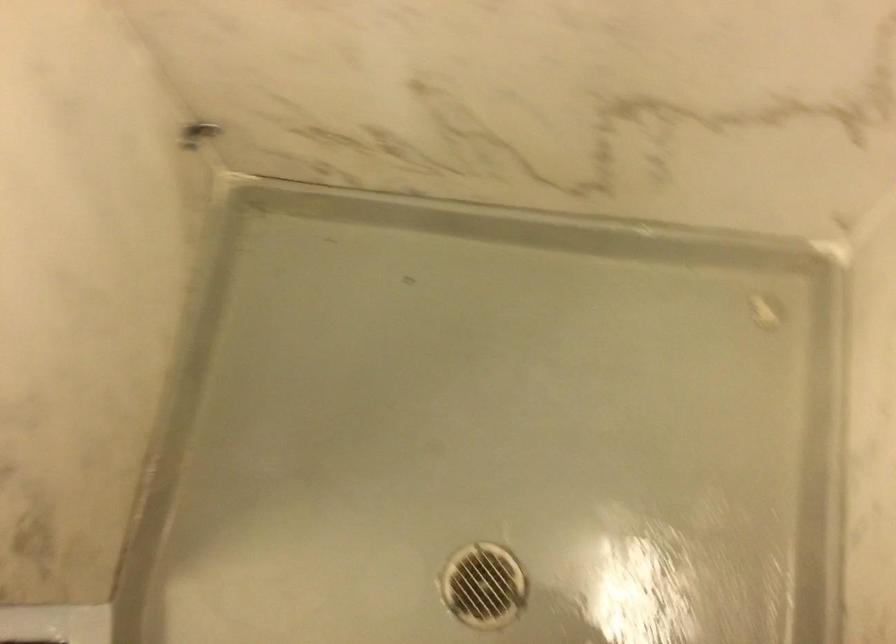
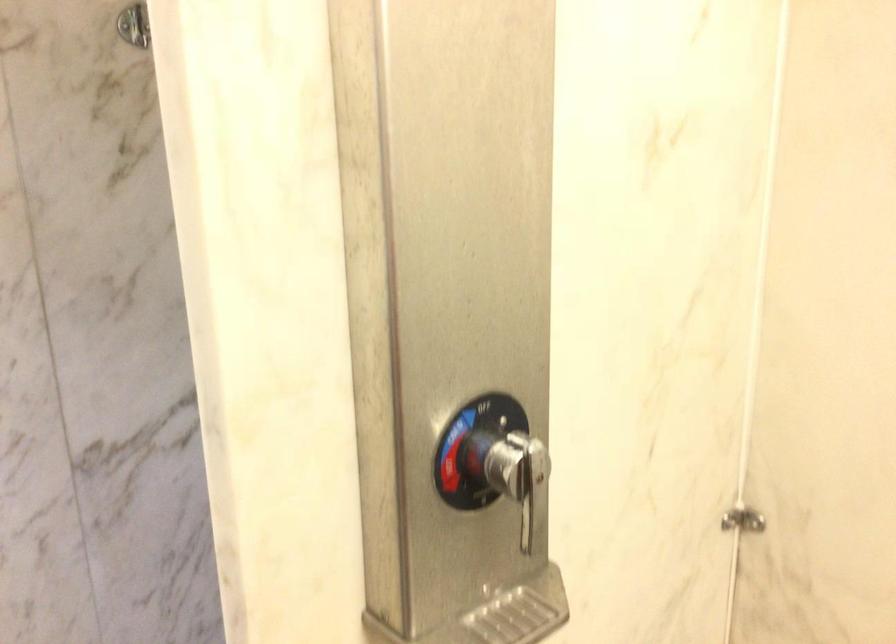
The first image is from the beginning of the video and the second image is from the end. How did the camera likely rotate when shooting the video?

The rotation direction of the camera is left-up.